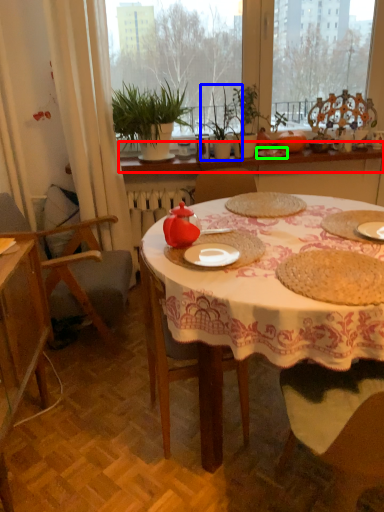
Question: Which object is positioned farthest from window sill (highlighted by a red box)? Select from plant (highlighted by a blue box) and tableware (highlighted by a green box).

Choices:
 (A) plant
 (B) tableware

Answer: (B)